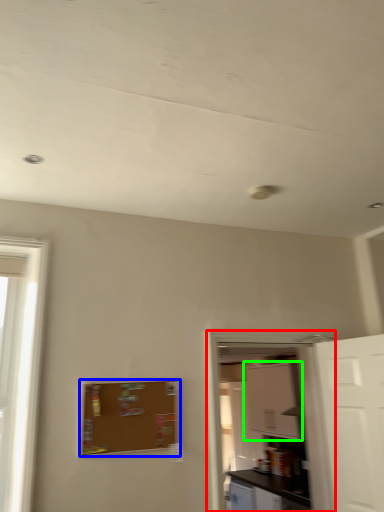
Question: Considering the real-world distances, which object is farthest from screen door (highlighted by a red box)? bulletin board (highlighted by a blue box) or cabinetry (highlighted by a green box)?

Choices:
 (A) bulletin board
 (B) cabinetry

Answer: (B)